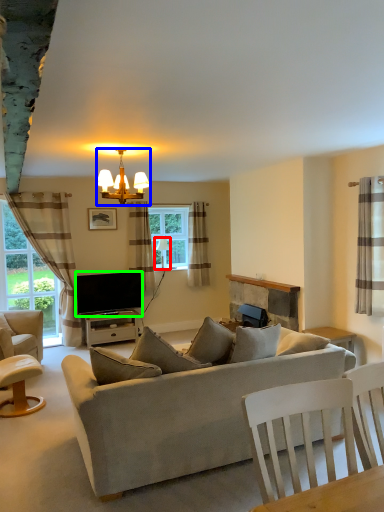
Question: Considering the real-world distances, which object is closest to lamp (highlighted by a red box)? lamp (highlighted by a blue box) or television (highlighted by a green box).

Choices:
 (A) lamp
 (B) television

Answer: (B)